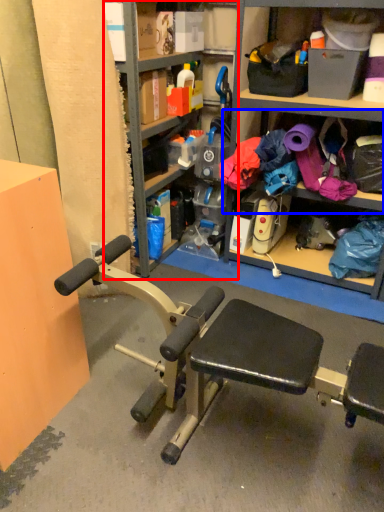
Question: Among these objects, which one is nearest to the camera, bookshelf (highlighted by a red box) or shelf (highlighted by a blue box)?

Choices:
 (A) bookshelf
 (B) shelf

Answer: (A)